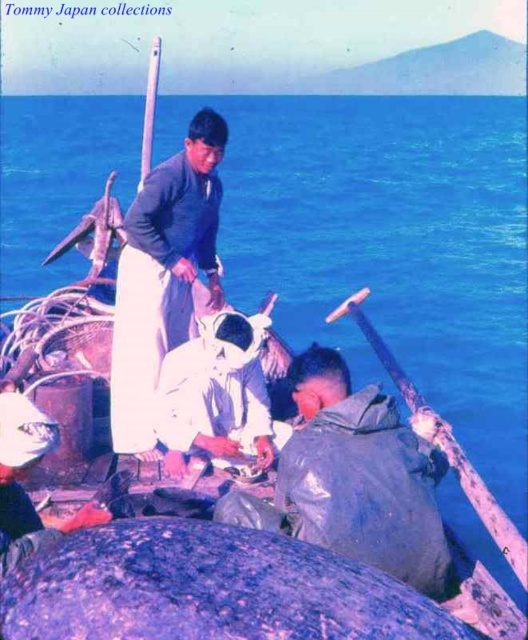
You are standing on the boat and want to move from the point at coordinates point (390, 404) to the point at coordinates point (162, 228). In which direction should you move relative to the boat?

You should move towards the back of the boat because point (390, 404) is in front of point (162, 228), meaning the latter is located behind the former.

You are standing on the dock and looking at the boat with the gray matte jacket at lower right and the matte blue shirt at center. Which person is closer to you?

The gray matte jacket at lower right is closer to the viewer than the matte blue shirt at center, so the person wearing the gray matte jacket at lower right is closer to you.